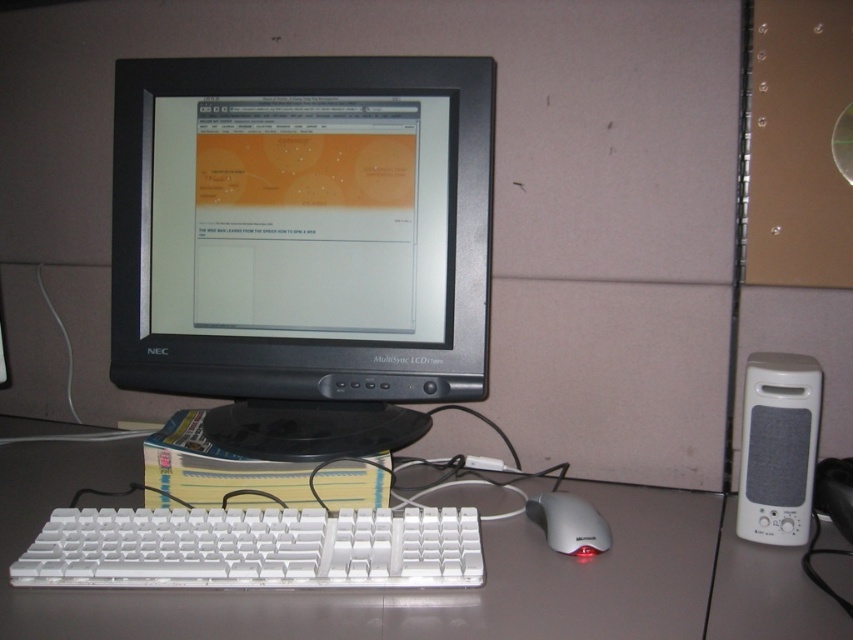
Question: Does white plastic keyboard at center have a larger size compared to white plastic speaker at right?

Choices:
 (A) yes
 (B) no

Answer: (A)

Question: Among these points, which one is farthest from the camera?

Choices:
 (A) (596, 541)
 (B) (807, 444)

Answer: (B)

Question: Does white plastic keyboard at center have a lesser width compared to white plastic speaker at right?

Choices:
 (A) yes
 (B) no

Answer: (B)

Question: Does white plastic speaker at right appear over white plastic mouse at lower center?

Choices:
 (A) yes
 (B) no

Answer: (A)

Question: Which point is farther from the camera taking this photo?

Choices:
 (A) (335, 312)
 (B) (573, 532)

Answer: (A)

Question: Which point appears farthest from the camera in this image?

Choices:
 (A) (114, 326)
 (B) (425, 608)
 (C) (561, 525)
 (D) (775, 368)

Answer: (A)